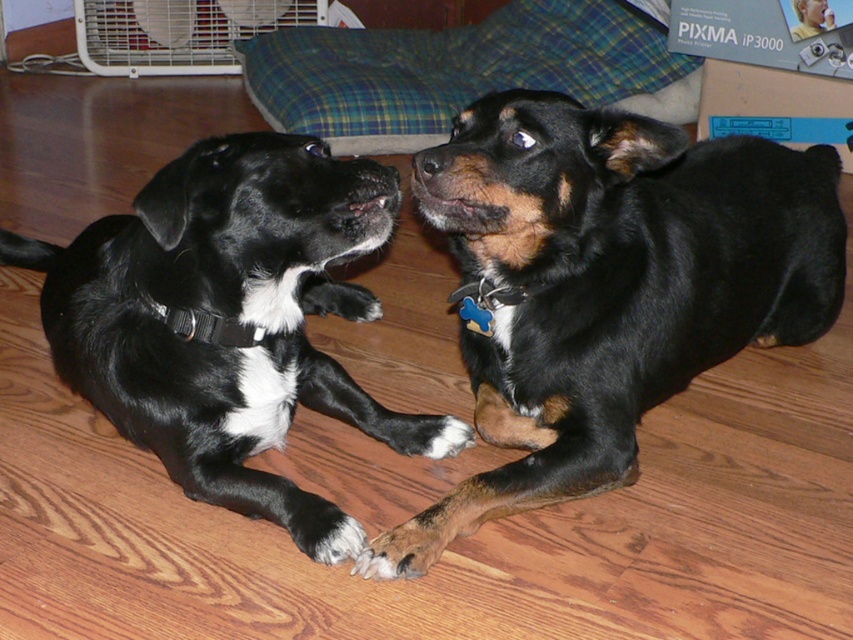
Does black matte dog at center have a lesser width compared to smooth plastic toy at upper right?

No.

Image resolution: width=853 pixels, height=640 pixels. Describe the element at coordinates (229, 320) in the screenshot. I see `black matte dog at center` at that location.

Between point (341, 301) and point (828, 16), which one is positioned in front?

Positioned in front is point (341, 301).

This screenshot has height=640, width=853. Find the location of `black matte dog at center`. black matte dog at center is located at coordinates (229, 320).

Is point (769, 179) positioned in front of point (415, 540)?

That is False.

Which of these two, black shiny dog at center or brown furry paw at lower center, stands shorter?

With less height is brown furry paw at lower center.

Find the location of a particular element. This screenshot has width=853, height=640. black shiny dog at center is located at coordinates (616, 275).

What are the coordinates of `black shiny dog at center` in the screenshot? It's located at (616, 275).

Is black shiny dog at center positioned behind smooth plastic toy at upper right?

No, it is not.

Does black shiny dog at center have a larger size compared to smooth plastic toy at upper right?

Yes.

Locate an element on the screen. This screenshot has height=640, width=853. black shiny dog at center is located at coordinates (616, 275).